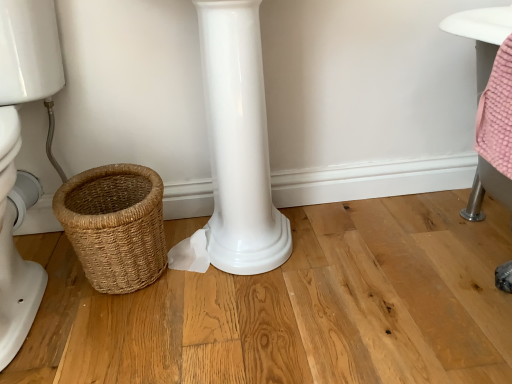
Question: Does braided wicker basket at lower left have a lesser height compared to white glossy toilet at left?

Choices:
 (A) yes
 (B) no

Answer: (A)

Question: Is braided wicker basket at lower left bigger than white glossy toilet at left?

Choices:
 (A) no
 (B) yes

Answer: (A)

Question: Is braided wicker basket at lower left further to the viewer compared to white glossy toilet at left?

Choices:
 (A) yes
 (B) no

Answer: (A)

Question: From a real-world perspective, does braided wicker basket at lower left stand above white glossy toilet at left?

Choices:
 (A) yes
 (B) no

Answer: (B)

Question: From the image's perspective, is braided wicker basket at lower left under white glossy toilet at left?

Choices:
 (A) no
 (B) yes

Answer: (B)

Question: Is braided wicker basket at lower left next to white glossy toilet at left and touching it?

Choices:
 (A) no
 (B) yes

Answer: (A)

Question: From a real-world perspective, is white glossy toilet at left beneath braided wicker basket at lower left?

Choices:
 (A) yes
 (B) no

Answer: (B)

Question: From the image's perspective, would you say white glossy toilet at left is shown under braided wicker basket at lower left?

Choices:
 (A) no
 (B) yes

Answer: (A)

Question: Is white glossy toilet at left turned away from braided wicker basket at lower left?

Choices:
 (A) yes
 (B) no

Answer: (B)

Question: Is white glossy toilet at left outside of braided wicker basket at lower left?

Choices:
 (A) yes
 (B) no

Answer: (A)

Question: Considering the relative sizes of white glossy toilet at left and braided wicker basket at lower left in the image provided, is white glossy toilet at left shorter than braided wicker basket at lower left?

Choices:
 (A) yes
 (B) no

Answer: (B)

Question: Is white glossy toilet at left at the right side of braided wicker basket at lower left?

Choices:
 (A) yes
 (B) no

Answer: (B)

Question: Which is correct: white glossy toilet at left is inside braided wicker basket at lower left, or outside of it?

Choices:
 (A) outside
 (B) inside

Answer: (A)